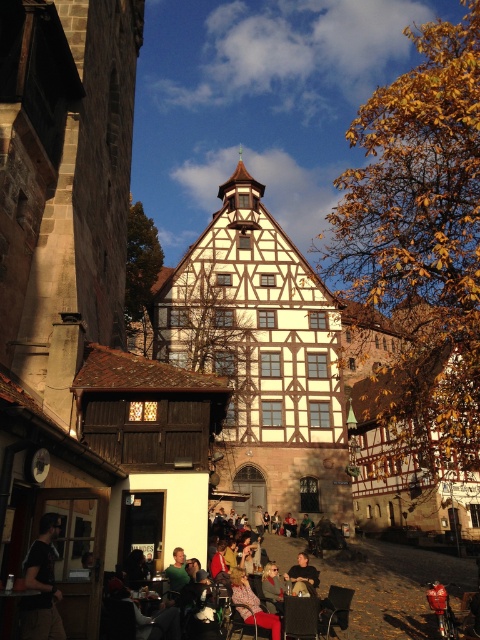
Question: Does dark gray fabric jacket at lower left appear under matte black jacket at center?

Choices:
 (A) yes
 (B) no

Answer: (B)

Question: Does dark gray fabric jacket at lower left have a larger size compared to matte black jacket at center?

Choices:
 (A) yes
 (B) no

Answer: (B)

Question: Is dark gray fabric jacket at lower left above matte black jacket at center?

Choices:
 (A) yes
 (B) no

Answer: (A)